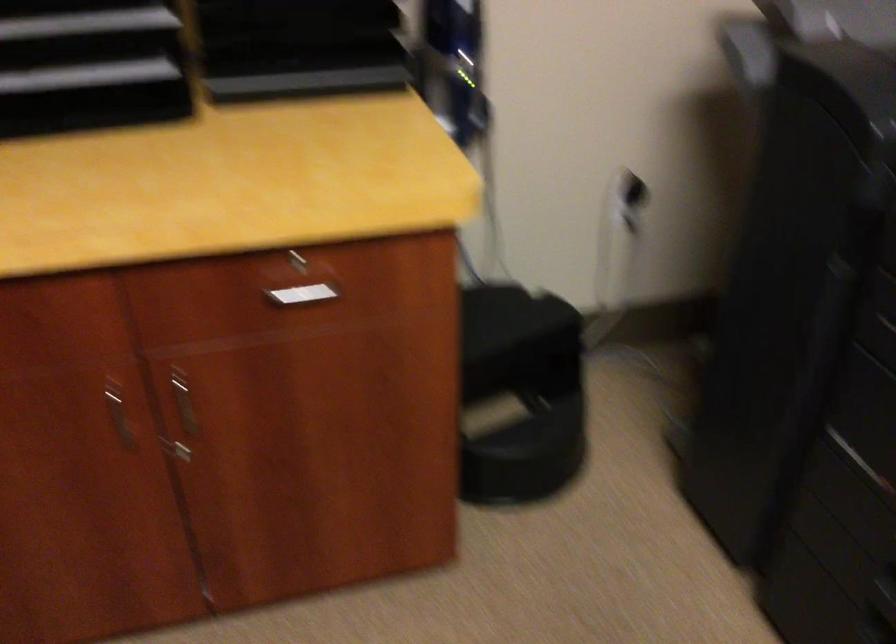
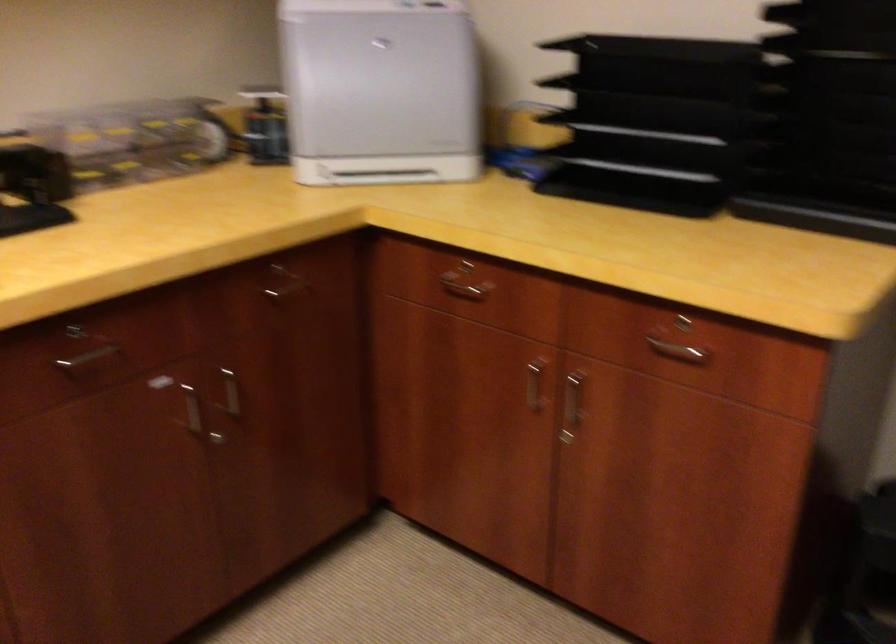
Where in the second image is the point corresponding to (x=295, y=290) from the first image?

(677, 351)